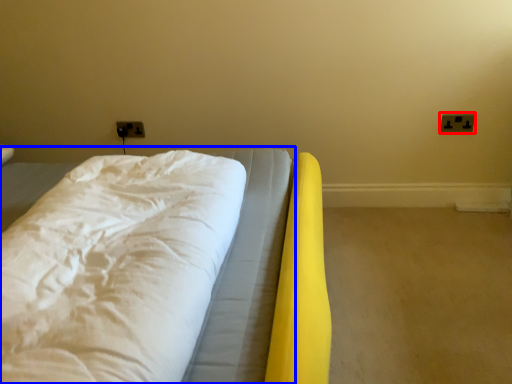
Question: Which object is further to the camera taking this photo, electric outlet (highlighted by a red box) or bed (highlighted by a blue box)?

Choices:
 (A) electric outlet
 (B) bed

Answer: (A)